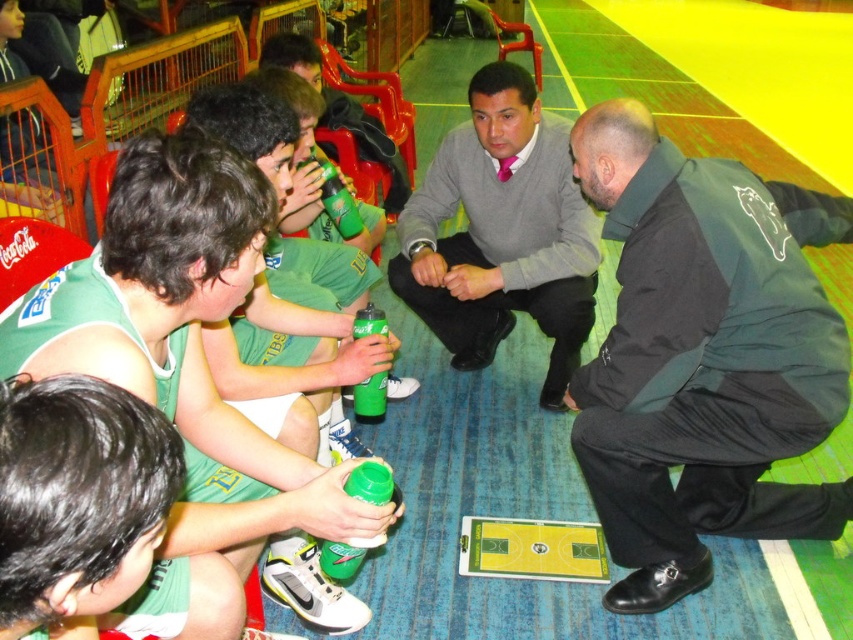
Between green jersey at center and gray sweater at center, which one is positioned higher?

gray sweater at center is above.

Does point (202, 196) come behind point (527, 225)?

That is False.

Is point (181, 358) positioned before point (427, 221)?

Yes, it is.

What are the coordinates of `green jersey at center` in the screenshot? It's located at (184, 358).

Is gray sweater at center above matte green uniform at lower left?

Yes, gray sweater at center is above matte green uniform at lower left.

Between point (473, 97) and point (332, 268), which one is positioned behind?

Positioned behind is point (473, 97).

This screenshot has height=640, width=853. Identify the location of gray sweater at center. (502, 232).

Is green matte water bottle at center in front of green matte bottle at center?

Yes, it is.

Is green matte water bottle at center shorter than green matte bottle at center?

Correct, green matte water bottle at center is not as tall as green matte bottle at center.

I want to click on green matte water bottle at center, so click(370, 397).